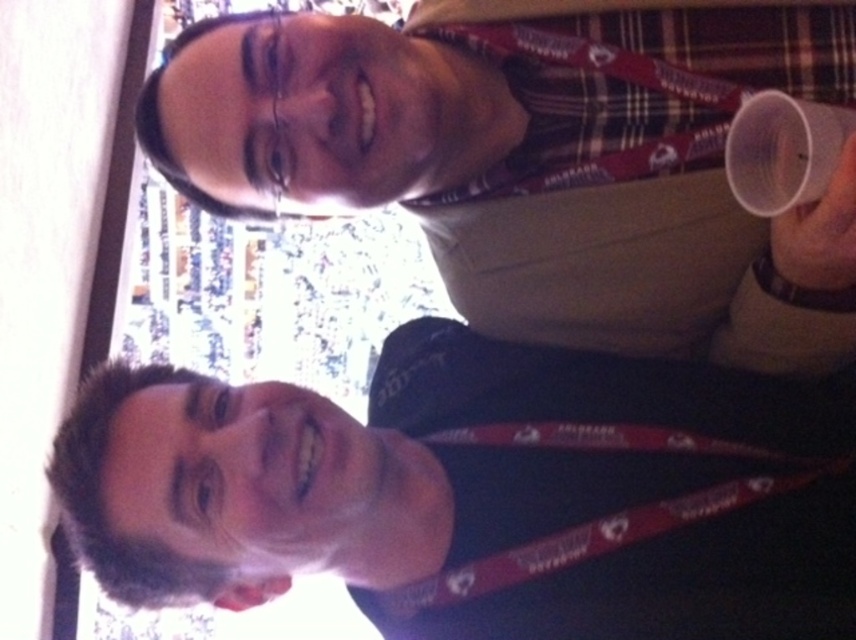
Is the position of white matte face at lower left more distant than that of matte plastic cup at upper right?

Yes, white matte face at lower left is behind matte plastic cup at upper right.

Can you confirm if white matte face at lower left is bigger than matte plastic cup at upper right?

No.

Does point (520, 500) come farther from viewer compared to point (670, 337)?

No, (520, 500) is closer to viewer.

At what (x,y) coordinates should I click in order to perform the action: click on white matte face at lower left. Please return your answer as a coordinate pair (x, y). Looking at the image, I should click on 482,492.

Does matte plastic cup at upper right appear under transparent plastic cup at upper right?

Actually, matte plastic cup at upper right is above transparent plastic cup at upper right.

Describe the element at coordinates (535, 163) in the screenshot. The image size is (856, 640). I see `matte plastic cup at upper right` at that location.

Identify the location of matte plastic cup at upper right. The width and height of the screenshot is (856, 640). (535, 163).

Is white matte face at lower left positioned before transparent plastic cup at upper right?

No, it is behind transparent plastic cup at upper right.

Can you confirm if white matte face at lower left is thinner than transparent plastic cup at upper right?

No, white matte face at lower left is not thinner than transparent plastic cup at upper right.

Identify the location of white matte face at lower left. (482, 492).

You are a GUI agent. You are given a task and a screenshot of the screen. Output one action in this format:
    pyautogui.click(x=<x>, y=<y>)
    Task: Click on the white matte face at lower left
    The width and height of the screenshot is (856, 640).
    Given the screenshot: What is the action you would take?
    pyautogui.click(x=482, y=492)